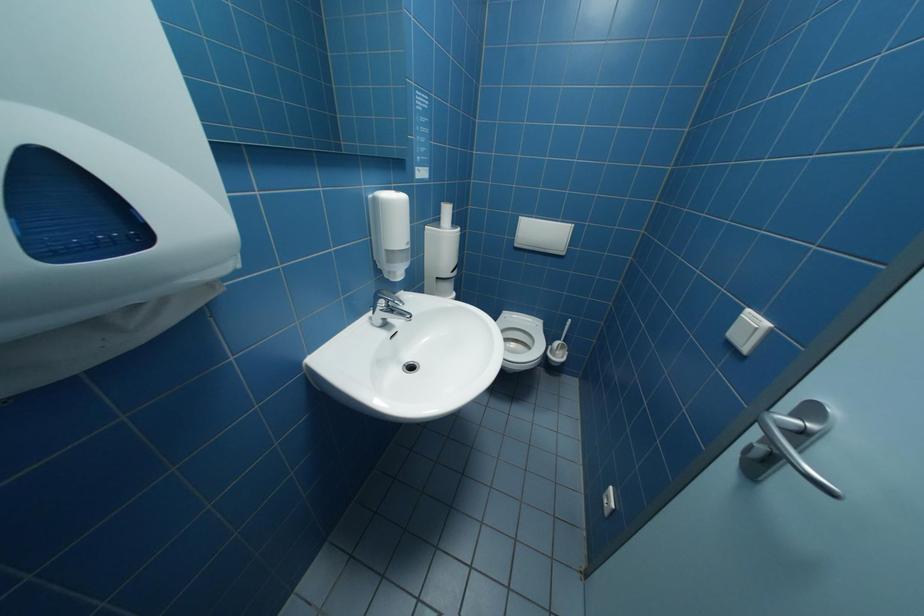
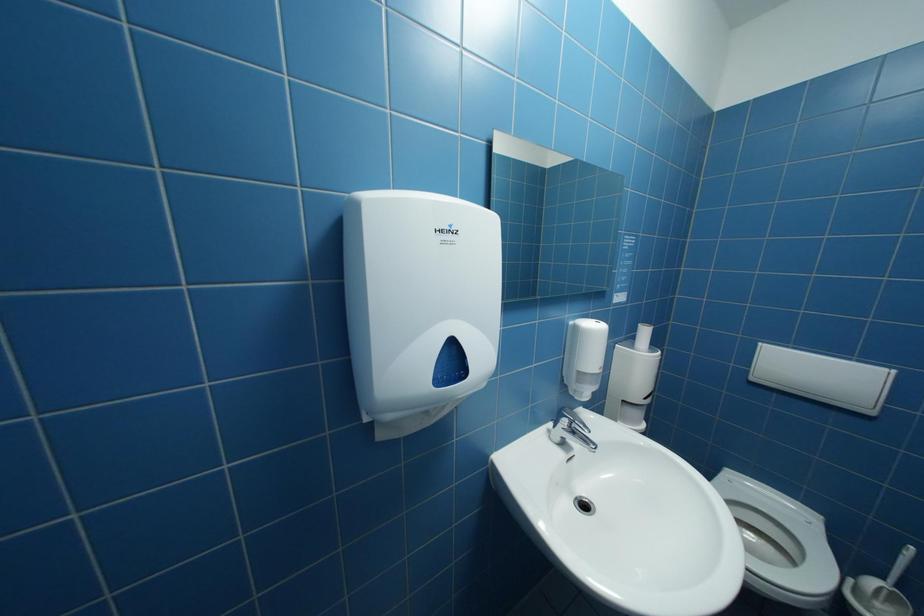
Question: Based on the continuous images, in which direction is the camera rotating? Reply with the corresponding letter.

Choices:
 (A) Left
 (B) Right
 (C) Up
 (D) Down

Answer: (A)